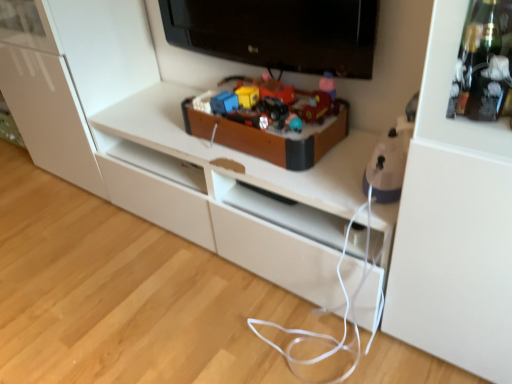
Question: Based on their sizes in the image, would you say wooden toy box at center, which is the second toy in front-to-back order, is bigger or smaller than purple plastic iron at right, which is the 2th toy in back-to-front order?

Choices:
 (A) small
 (B) big

Answer: (B)

Question: From their relative heights in the image, would you say wooden toy box at center, positioned as the 1th toy in back-to-front order, is taller or shorter than purple plastic iron at right, which is the first toy from right to left?

Choices:
 (A) tall
 (B) short

Answer: (B)

Question: Which of these objects is positioned farthest from the wooden toy box at center, the 1th toy positioned from the left?

Choices:
 (A) purple plastic iron at right, which is the 2th toy in back-to-front order
 (B) black glossy television at upper center

Answer: (A)

Question: Which object is the farthest from the black glossy television at upper center?

Choices:
 (A) purple plastic iron at right, which is the first toy from right to left
 (B) wooden toy box at center, the 1th toy positioned from the left

Answer: (A)